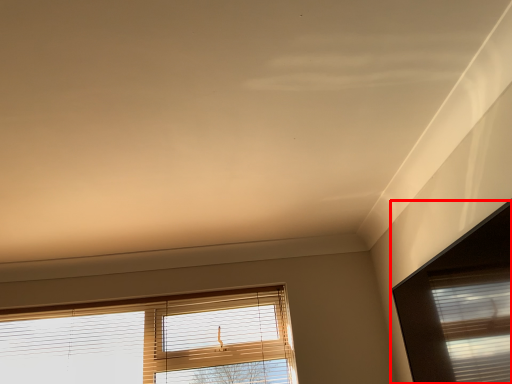
Question: From the image's perspective, where is window (annotated by the red box) located in relation to window in the image?

Choices:
 (A) above
 (B) below

Answer: (A)